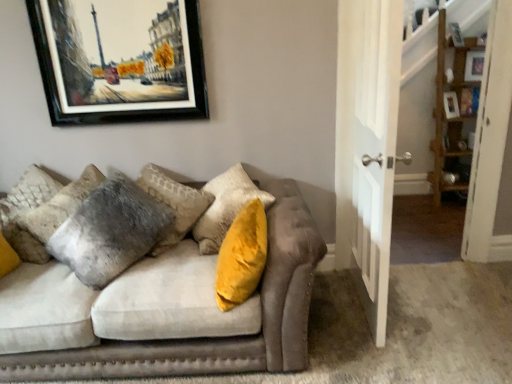
Locate an element on the screen. The height and width of the screenshot is (384, 512). vacant area that lies to the right of white wooden door at center is located at coordinates (447, 307).